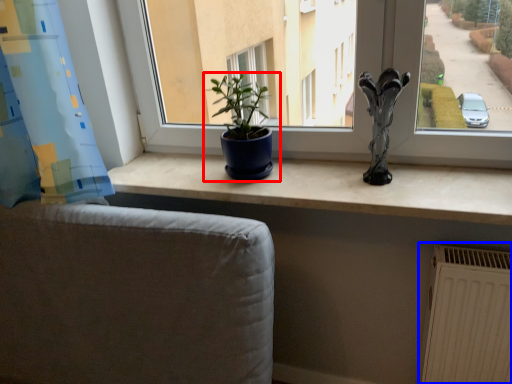
Question: Which object appears closest to the camera in this image, houseplant (highlighted by a red box) or radiator (highlighted by a blue box)?

Choices:
 (A) houseplant
 (B) radiator

Answer: (B)